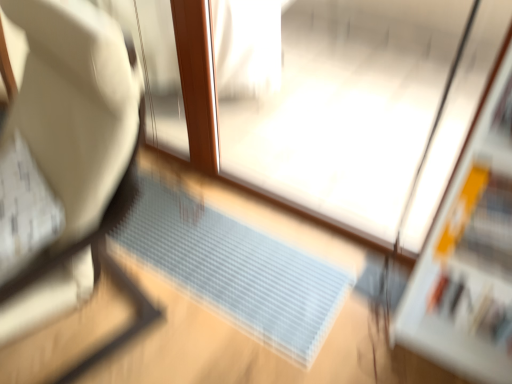
Question: Is white fabric chair at left thinner than translucent plastic doormat at center?

Choices:
 (A) yes
 (B) no

Answer: (B)

Question: Does white fabric chair at left have a greater width compared to translucent plastic doormat at center?

Choices:
 (A) no
 (B) yes

Answer: (B)

Question: Could you tell me if white fabric chair at left is turned towards translucent plastic doormat at center?

Choices:
 (A) no
 (B) yes

Answer: (A)

Question: Is white fabric chair at left positioned with its back to translucent plastic doormat at center?

Choices:
 (A) no
 (B) yes

Answer: (B)

Question: Can you confirm if white fabric chair at left is positioned to the right of translucent plastic doormat at center?

Choices:
 (A) no
 (B) yes

Answer: (A)

Question: Based on their positions, is white fabric chair at left located to the left or right of transparent plastic screen door at center?

Choices:
 (A) left
 (B) right

Answer: (A)

Question: In the image, is white fabric chair at left positioned in front of or behind transparent plastic screen door at center?

Choices:
 (A) behind
 (B) front

Answer: (B)

Question: Is white fabric chair at left bigger or smaller than transparent plastic screen door at center?

Choices:
 (A) small
 (B) big

Answer: (B)

Question: Is white fabric chair at left wider or thinner than transparent plastic screen door at center?

Choices:
 (A) wide
 (B) thin

Answer: (A)

Question: Based on their positions, is transparent plastic screen door at center located to the left or right of white fabric chair at left?

Choices:
 (A) right
 (B) left

Answer: (A)

Question: From a real-world perspective, is transparent plastic screen door at center physically located above or below white fabric chair at left?

Choices:
 (A) above
 (B) below

Answer: (B)

Question: Considering the positions of point (376, 92) and point (52, 253), is point (376, 92) closer or farther from the camera than point (52, 253)?

Choices:
 (A) farther
 (B) closer

Answer: (A)

Question: Which is correct: transparent plastic screen door at center is inside white fabric chair at left, or outside of it?

Choices:
 (A) inside
 (B) outside

Answer: (B)

Question: From the image's perspective, relative to white fabric chair at left, is translucent plastic doormat at center above or below?

Choices:
 (A) below
 (B) above

Answer: (A)

Question: Is translucent plastic doormat at center taller or shorter than white fabric chair at left?

Choices:
 (A) short
 (B) tall

Answer: (A)